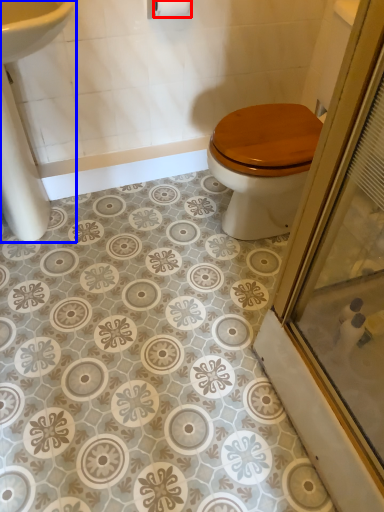
Question: Among these objects, which one is nearest to the camera, toilet paper (highlighted by a red box) or sink (highlighted by a blue box)?

Choices:
 (A) toilet paper
 (B) sink

Answer: (B)